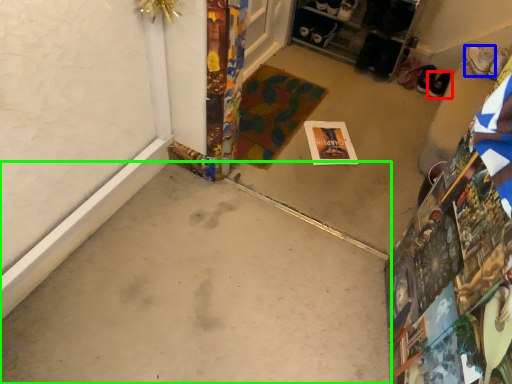
Question: Which is nearer to the footwear (highlighted by a red box)? footwear (highlighted by a blue box) or concrete (highlighted by a green box).

Choices:
 (A) footwear
 (B) concrete

Answer: (A)